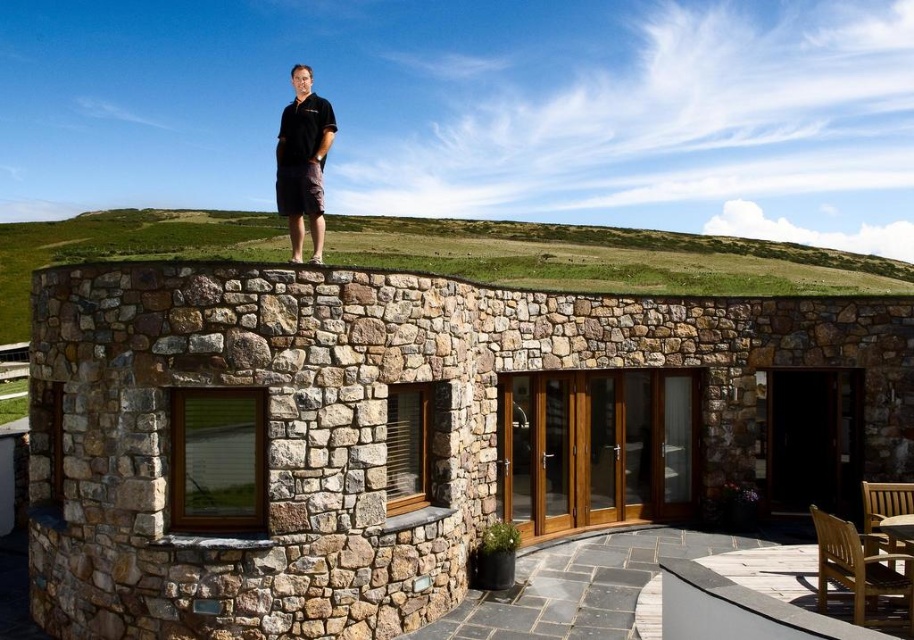
Does point (872, 256) lie behind point (311, 218)?

Yes, point (872, 256) is behind point (311, 218).

Does natural grass at upper center have a greater width compared to black cotton shirt at upper center?

Correct, the width of natural grass at upper center exceeds that of black cotton shirt at upper center.

Find the location of a particular element. natural grass at upper center is located at coordinates (607, 257).

Is white concrete ledge at lower right bigger than black cotton shirt at upper center?

Actually, white concrete ledge at lower right might be smaller than black cotton shirt at upper center.

Is point (755, 584) closer to camera compared to point (327, 138)?

No, (755, 584) is further to viewer.

Image resolution: width=914 pixels, height=640 pixels. Describe the element at coordinates (748, 596) in the screenshot. I see `white concrete ledge at lower right` at that location.

In order to click on white concrete ledge at lower right in this screenshot , I will do `click(748, 596)`.

Which is behind, point (560, 250) or point (796, 548)?

The point (560, 250) is behind.

Describe the element at coordinates (607, 257) in the screenshot. The image size is (914, 640). I see `natural grass at upper center` at that location.

At what (x,y) coordinates should I click in order to perform the action: click on natural grass at upper center. Please return your answer as a coordinate pair (x, y). The height and width of the screenshot is (640, 914). Looking at the image, I should click on (607, 257).